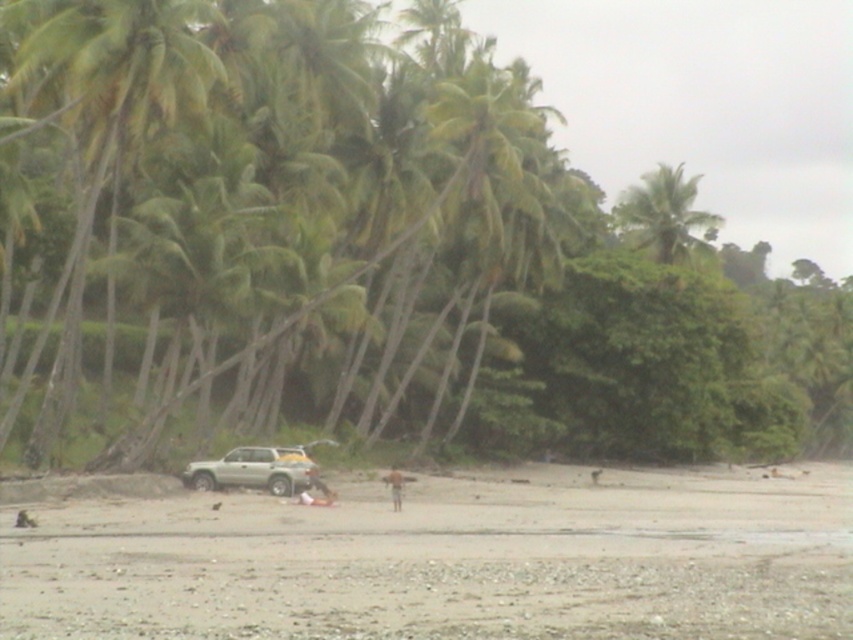
Is green leafy palm tree at upper right wider than silver metallic jeep at lower center?

Yes, green leafy palm tree at upper right is wider than silver metallic jeep at lower center.

Who is positioned more to the left, green leafy palm tree at upper right or silver metallic jeep at lower center?

From the viewer's perspective, silver metallic jeep at lower center appears more on the left side.

Between point (679, 253) and point (299, 451), which one is positioned in front?

Point (299, 451) is more forward.

This screenshot has height=640, width=853. I want to click on green leafy palm tree at upper right, so click(x=664, y=214).

Does metallic silver car at center appear on the left side of green leafy palm tree at upper right?

Yes, metallic silver car at center is to the left of green leafy palm tree at upper right.

Describe the element at coordinates (357, 250) in the screenshot. I see `metallic silver car at center` at that location.

Who is more distant from viewer, (405,230) or (651,189)?

Positioned behind is point (651,189).

Find the location of a particular element. metallic silver car at center is located at coordinates (357, 250).

Is point (381, 536) closer to viewer compared to point (253, 481)?

Yes, it is.

Does smooth beige sand at center appear under silver metallic jeep at lower center?

Correct, smooth beige sand at center is located below silver metallic jeep at lower center.

Locate an element on the screen. The height and width of the screenshot is (640, 853). smooth beige sand at center is located at coordinates (448, 561).

Find the location of a particular element. Image resolution: width=853 pixels, height=640 pixels. smooth beige sand at center is located at coordinates (448, 561).